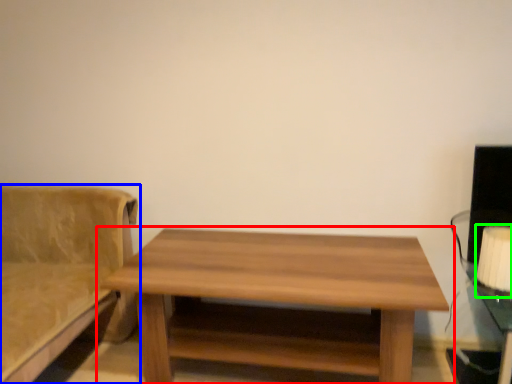
Question: Estimate the real-world distances between objects in this image. Which object is farther from table (highlighted by a red box), studio couch (highlighted by a blue box) or table lamp (highlighted by a green box)?

Choices:
 (A) studio couch
 (B) table lamp

Answer: (B)